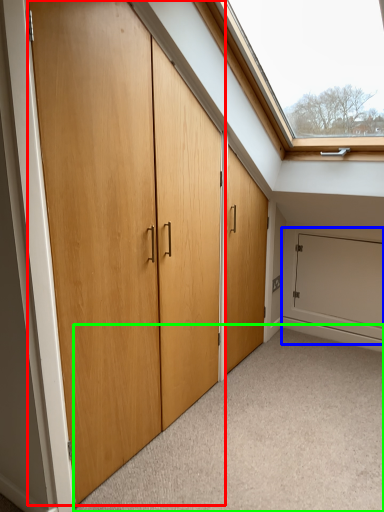
Question: Which is nearer to the door (highlighted by a red box)? garage door (highlighted by a blue box) or plain (highlighted by a green box).

Choices:
 (A) garage door
 (B) plain

Answer: (B)